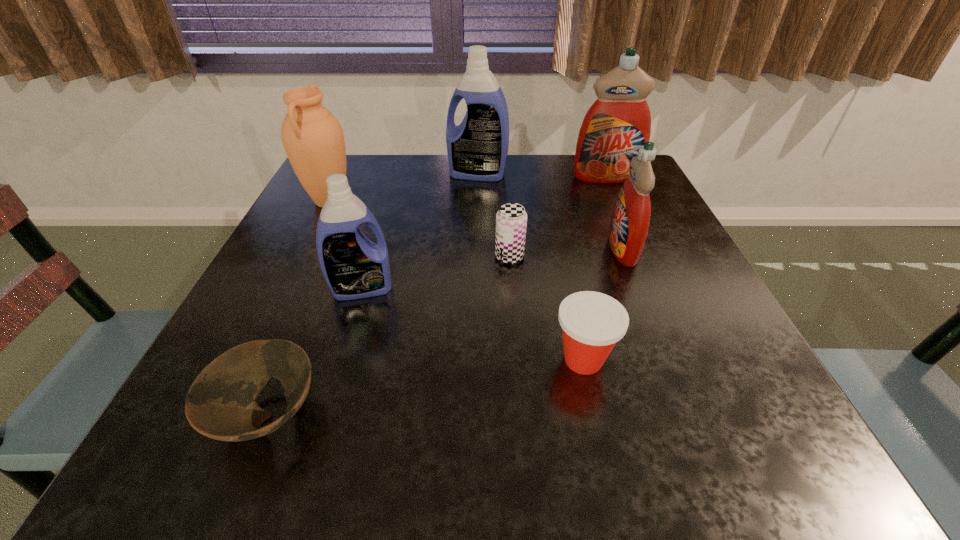
Where is `the bigger blue detergent`? The width and height of the screenshot is (960, 540). the bigger blue detergent is located at coordinates (477, 149).

This screenshot has width=960, height=540. In order to click on the farther blue detergent in this screenshot , I will do `click(477, 149)`.

Identify the location of the farther red detergent. The width and height of the screenshot is (960, 540). (618, 123).

At what (x,y) coordinates should I click in order to perform the action: click on urn. Please return your answer as a coordinate pair (x, y). The image size is (960, 540). Looking at the image, I should click on (313, 139).

At what (x,y) coordinates should I click in order to perform the action: click on the nearer red detergent. Please return your answer as a coordinate pair (x, y). The image size is (960, 540). Looking at the image, I should click on 630,220.

You are a GUI agent. You are given a task and a screenshot of the screen. Output one action in this format:
    pyautogui.click(x=<x>, y=<y>)
    Task: Click on the third farthest detergent
    The height and width of the screenshot is (540, 960).
    Given the screenshot: What is the action you would take?
    pyautogui.click(x=630, y=220)

This screenshot has width=960, height=540. What are the coordinates of `the smaller blue detergent` in the screenshot? It's located at (354, 267).

You are a GUI agent. You are given a task and a screenshot of the screen. Output one action in this format:
    pyautogui.click(x=<x>, y=<y>)
    Task: Click on the sixth farthest object
    
    Given the screenshot: What is the action you would take?
    pyautogui.click(x=354, y=267)

Identify the location of purple beer can. (511, 219).

Locate an element on the screen. This screenshot has width=960, height=540. the third object from right to left is located at coordinates (592, 323).